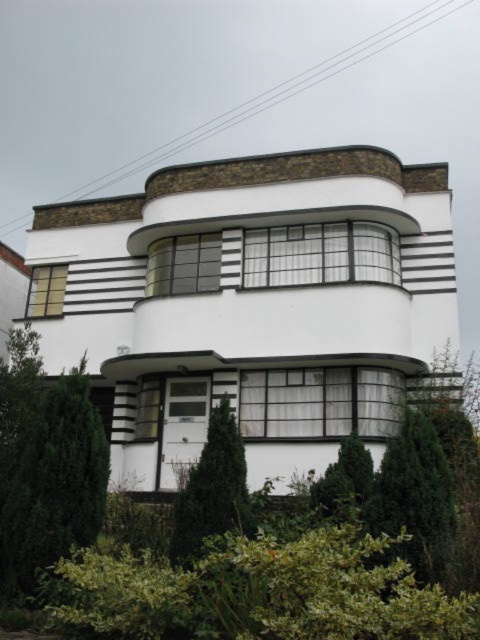
Between point (28, 420) and point (217, 422), which one is positioned behind?

Positioned behind is point (28, 420).

Is green leafy tree at lower left smaller than green leafy bush at center?

Yes.

Measure the distance between green leafy tree at lower left and camera.

They are 47.58 feet apart.

At what (x,y) coordinates should I click in order to perform the action: click on green leafy tree at lower left. Please return your answer as a coordinate pair (x, y). The image size is (480, 640). Looking at the image, I should click on (46, 465).